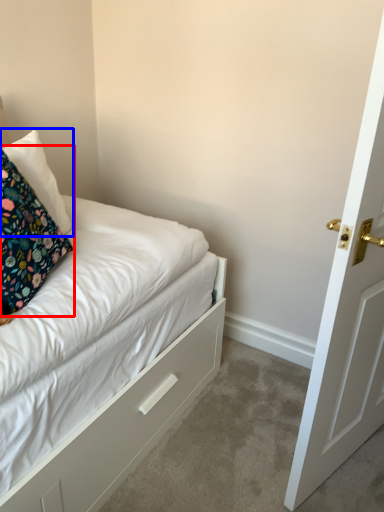
Question: Which object is further to the camera taking this photo, pillow (highlighted by a red box) or pillow (highlighted by a blue box)?

Choices:
 (A) pillow
 (B) pillow

Answer: (B)